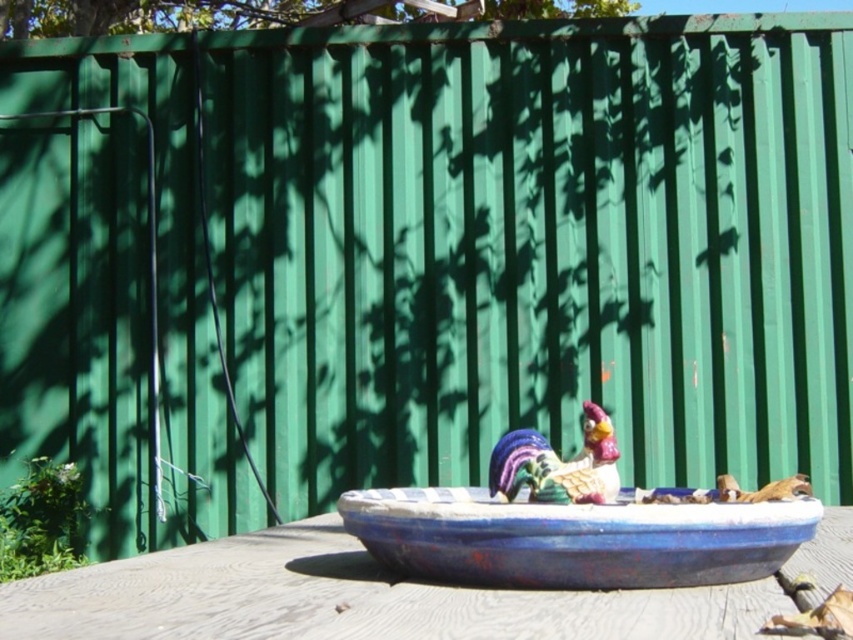
Question: Among these objects, which one is farthest from the camera?

Choices:
 (A) blue painted ceramic bowl at center
 (B) wooden table at center

Answer: (A)

Question: Is wooden table at center closer to the viewer compared to blue painted ceramic bowl at center?

Choices:
 (A) no
 (B) yes

Answer: (B)

Question: Is wooden table at center to the left of blue painted ceramic bowl at center from the viewer's perspective?

Choices:
 (A) no
 (B) yes

Answer: (A)

Question: Which point is closer to the camera?

Choices:
 (A) [722, 570]
 (B) [610, 428]

Answer: (A)

Question: Is blue painted ceramic bowl at center positioned behind multicolored glazed ceramic rooster at center?

Choices:
 (A) no
 (B) yes

Answer: (A)

Question: Considering the real-world distances, which object is farthest from the wooden table at center?

Choices:
 (A) multicolored glazed ceramic rooster at center
 (B) blue painted ceramic bowl at center

Answer: (A)